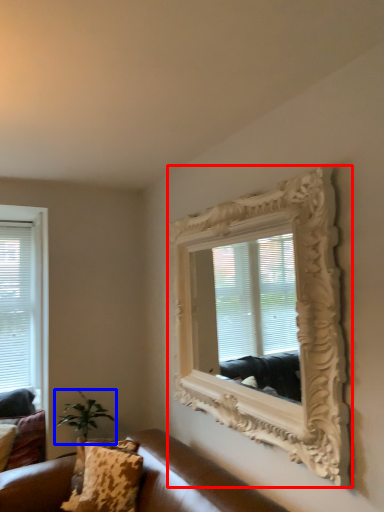
Question: Which point is further to the camera, picture frame (highlighted by a red box) or houseplant (highlighted by a blue box)?

Choices:
 (A) picture frame
 (B) houseplant

Answer: (B)